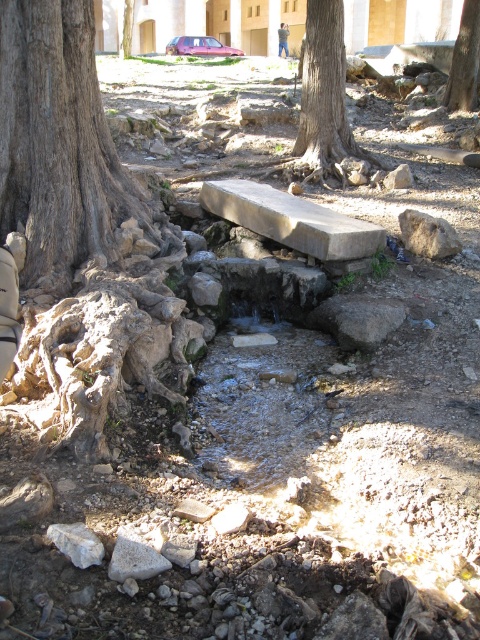
Question: Is brown rough rock at center below brown leather jacket at upper center?

Choices:
 (A) yes
 (B) no

Answer: (A)

Question: Among these points, which one is farthest from the camera?

Choices:
 (A) (319, 227)
 (B) (478, 42)
 (C) (284, 38)

Answer: (C)

Question: Which of the following is the farthest from the observer?

Choices:
 (A) brown rough rock at center
 (B) smooth stone bench at center
 (C) brown rough tree at upper center

Answer: (C)

Question: Where is brown rough tree at center located in relation to smooth stone bench at center in the image?

Choices:
 (A) right
 (B) left

Answer: (A)

Question: Which of the following is the farthest from the observer?

Choices:
 (A) brown rough tree trunk at left
 (B) brown rough tree at center
 (C) brown rough rock at center
 (D) brown rough tree at upper center

Answer: (D)

Question: Is brown rough tree trunk at left bigger than brown rough tree at upper center?

Choices:
 (A) no
 (B) yes

Answer: (B)